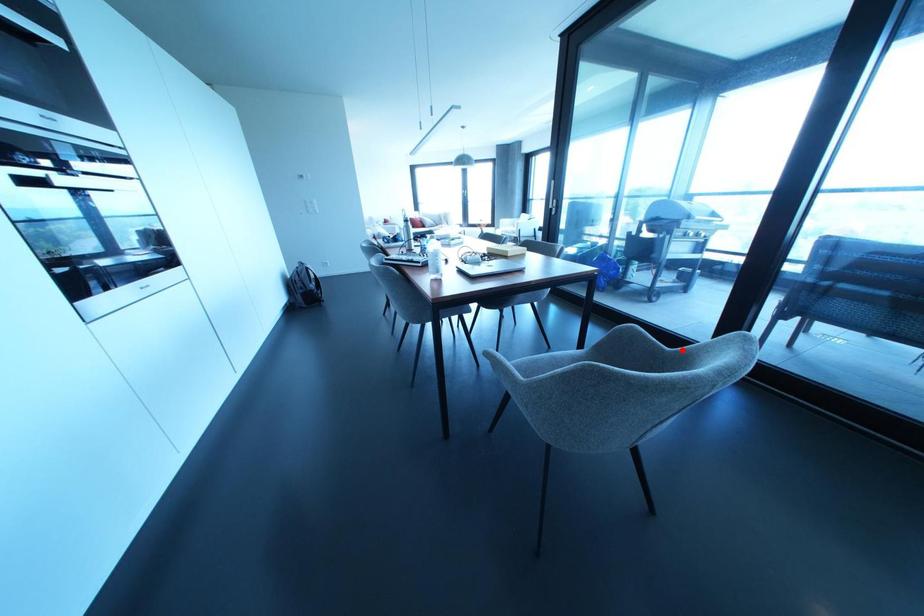
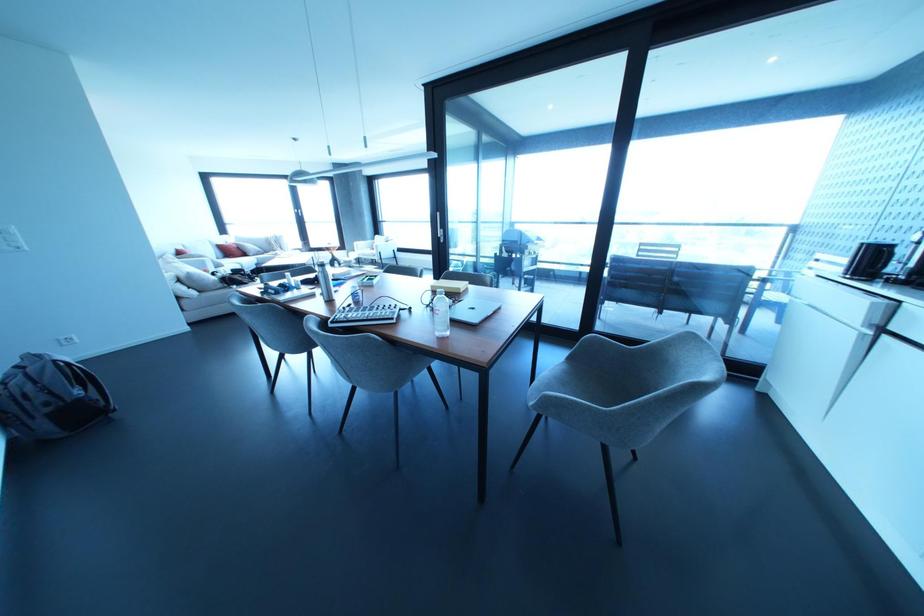
Question: I am providing you with two images of the same scene from different viewpoints. In image1, a red point is highlighted. Considering the same 3D point in image2, which of the following is correct?

Choices:
 (A) It is closer
 (B) It is farther

Answer: (B)